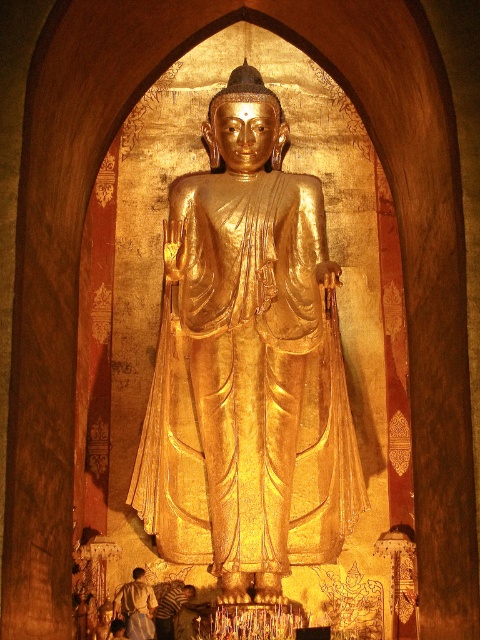
Which is more to the right, gold polished statue at center or white cloth at lower left?

From the viewer's perspective, gold polished statue at center appears more on the right side.

At what (x,y) coordinates should I click in order to perform the action: click on gold polished statue at center. Please return your answer as a coordinate pair (x, y). Image resolution: width=480 pixels, height=640 pixels. Looking at the image, I should click on (248, 365).